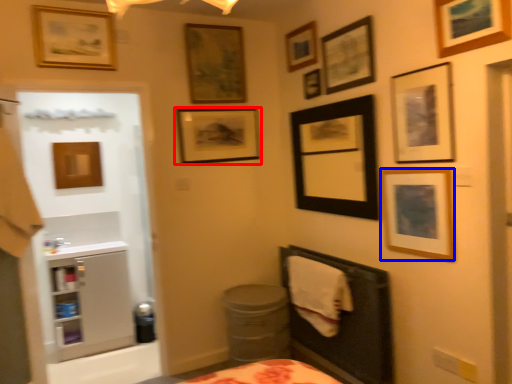
Question: Among these objects, which one is nearest to the camera, picture frame (highlighted by a red box) or picture frame (highlighted by a blue box)?

Choices:
 (A) picture frame
 (B) picture frame

Answer: (B)